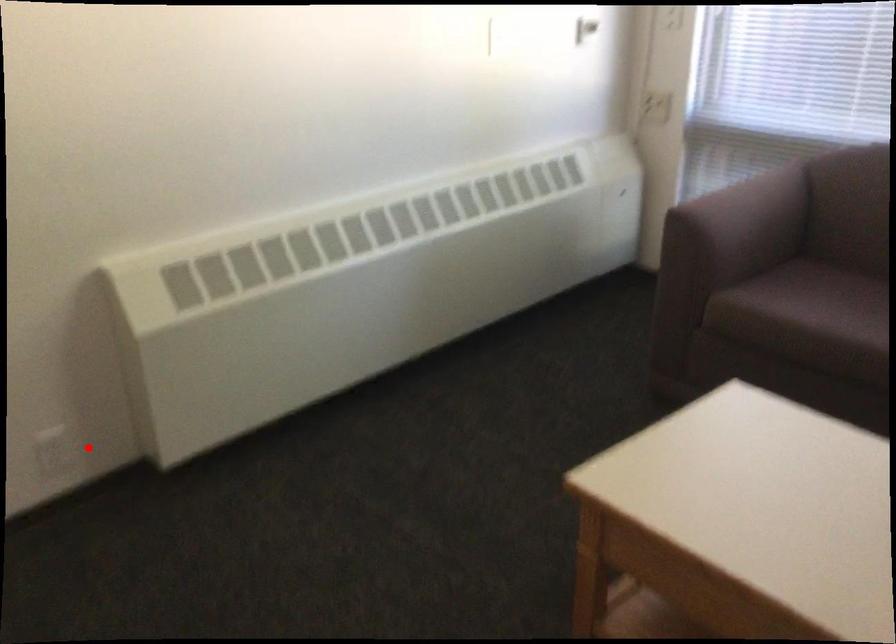
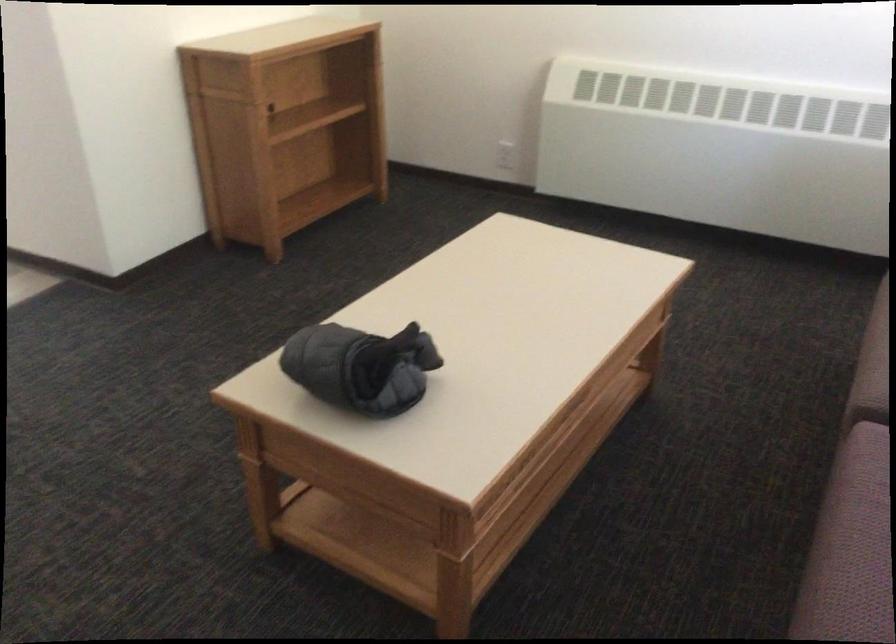
Where in the second image is the point corresponding to the highlighted location from the first image?

(505, 155)